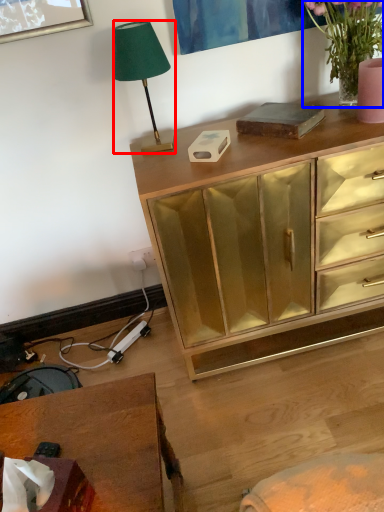
Question: Which point is further to the camera, lamp (highlighted by a red box) or houseplant (highlighted by a blue box)?

Choices:
 (A) lamp
 (B) houseplant

Answer: (A)